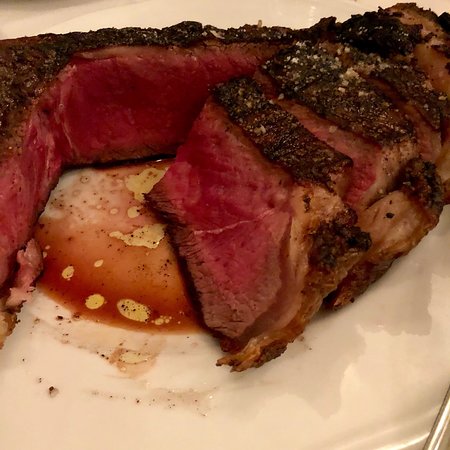
This screenshot has width=450, height=450. What are the coordinates of `plateplate` in the screenshot? It's located at (374, 373), (253, 417), (147, 434).